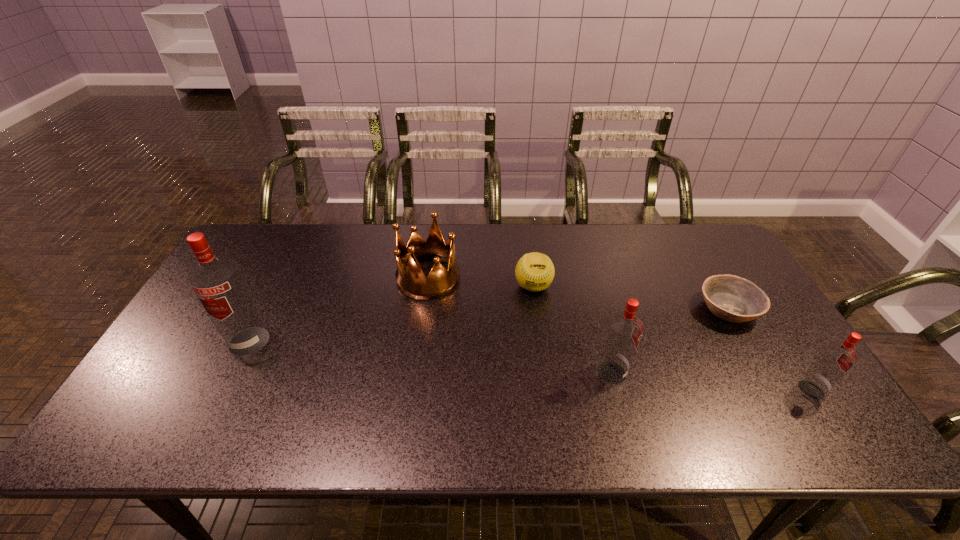
You are a GUI agent. You are given a task and a screenshot of the screen. Output one action in this format:
    pyautogui.click(x=<x>, y=<y>)
    Task: Click on the tallest vodka
    The width and height of the screenshot is (960, 540).
    Given the screenshot: What is the action you would take?
    pyautogui.click(x=217, y=281)

Locate an element on the screen. Image resolution: width=960 pixels, height=540 pixels. the leftmost object is located at coordinates (217, 281).

At what (x,y) coordinates should I click in order to perform the action: click on the second tallest object. Please return your answer as a coordinate pair (x, y). Looking at the image, I should click on (624, 331).

This screenshot has width=960, height=540. I want to click on the fourth object from left to right, so 624,331.

Locate an element on the screen. the shortest vodka is located at coordinates (836, 359).

This screenshot has height=540, width=960. What are the coordinates of `bowl` in the screenshot? It's located at (731, 298).

At what (x,y) coordinates should I click in order to perform the action: click on the fifth object from right to left. Please return your answer as a coordinate pair (x, y). This screenshot has height=540, width=960. Looking at the image, I should click on (412, 282).

Where is `softball`? The image size is (960, 540). softball is located at coordinates (534, 271).

The image size is (960, 540). What are the coordinates of `the third object from left to right` in the screenshot? It's located at (534, 271).

The image size is (960, 540). Identify the location of free spot located on the front label of the farthest vodka. (219, 402).